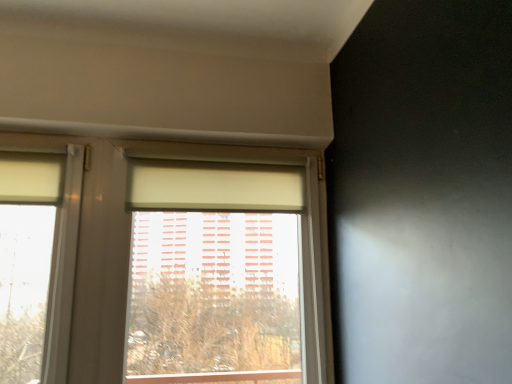
The width and height of the screenshot is (512, 384). Describe the element at coordinates (213, 186) in the screenshot. I see `beige fabric curtain at center` at that location.

The height and width of the screenshot is (384, 512). Identify the location of beige fabric curtain at center. (213, 186).

The height and width of the screenshot is (384, 512). What do you see at coordinates (164, 209) in the screenshot? I see `matte white window at center` at bounding box center [164, 209].

Where is `matte white window at center`? The width and height of the screenshot is (512, 384). matte white window at center is located at coordinates (164, 209).

Based on the photo, in order to face matte white window at center, should I rotate leftwards or rightwards?

To face it directly, rotate left by 4.725 degrees.

This screenshot has width=512, height=384. Identify the location of beige fabric curtain at center. (213, 186).

Which object is positioned more to the left, matte white window at center or beige fabric curtain at center?

beige fabric curtain at center.

Relative to beige fabric curtain at center, is matte white window at center in front or behind?

Clearly, matte white window at center is in front of beige fabric curtain at center.

Is point (287, 200) positioned before point (209, 163)?

That is False.

From the image's perspective, is matte white window at center under beige fabric curtain at center?

Correct, matte white window at center appears lower than beige fabric curtain at center in the image.

From a real-world perspective, is matte white window at center on top of beige fabric curtain at center?

No, from a real-world perspective, matte white window at center is not over beige fabric curtain at center

Can you confirm if matte white window at center is wider than beige fabric curtain at center?

Yes.

Which of these two, matte white window at center or beige fabric curtain at center, stands taller?

Standing taller between the two is matte white window at center.

Looking at the image, does matte white window at center seem bigger or smaller compared to beige fabric curtain at center?

In the image, matte white window at center appears to be larger than beige fabric curtain at center.

Could beige fabric curtain at center be considered to be inside matte white window at center?

Yes.

Is matte white window at center beside beige fabric curtain at center?

matte white window at center and beige fabric curtain at center are clearly separated.

Could you tell me if matte white window at center is turned towards beige fabric curtain at center?

Yes, matte white window at center faces towards beige fabric curtain at center.

How many degrees apart are the facing directions of matte white window at center and beige fabric curtain at center?

0.494 degrees separate the facing orientations of matte white window at center and beige fabric curtain at center.

Locate an element on the screen. The height and width of the screenshot is (384, 512). curtain located above the matte white window at center (from the image's perspective) is located at coordinates (213, 186).

Between beige fabric curtain at center and matte white window at center, which one appears on the left side from the viewer's perspective?

Positioned to the left is beige fabric curtain at center.

Is the position of beige fabric curtain at center more distant than that of matte white window at center?

Yes.

Considering the positions of point (280, 206) and point (133, 166), is point (280, 206) closer or farther from the camera than point (133, 166)?

Point (280, 206) is farther from the camera than point (133, 166).

From the image's perspective, would you say beige fabric curtain at center is shown under matte white window at center?

No.

From the picture: From a real-world perspective, is beige fabric curtain at center on top of matte white window at center?

Indeed, from a real-world perspective, beige fabric curtain at center stands above matte white window at center.

Considering the sizes of beige fabric curtain at center and matte white window at center in the image, is beige fabric curtain at center wider or thinner than matte white window at center?

Clearly, beige fabric curtain at center has less width compared to matte white window at center.

Considering the relative sizes of beige fabric curtain at center and matte white window at center in the image provided, is beige fabric curtain at center taller than matte white window at center?

In fact, beige fabric curtain at center may be shorter than matte white window at center.

Which of these two, beige fabric curtain at center or matte white window at center, is smaller?

beige fabric curtain at center.

Can matte white window at center be found inside beige fabric curtain at center?

Actually, matte white window at center is outside beige fabric curtain at center.

In the scene shown: Is beige fabric curtain at center far from matte white window at center?

beige fabric curtain at center is actually quite close to matte white window at center.

Based on the photo, is beige fabric curtain at center aimed at matte white window at center?

Yes, beige fabric curtain at center is turned towards matte white window at center.

In order to click on window below the beige fabric curtain at center (from the image's perspective) in this screenshot , I will do pos(164,209).

Identify the location of curtain behind the matte white window at center. Image resolution: width=512 pixels, height=384 pixels. (213, 186).

At what (x,y) coordinates should I click in order to perform the action: click on window in front of the beige fabric curtain at center. Please return your answer as a coordinate pair (x, y). The height and width of the screenshot is (384, 512). Looking at the image, I should click on point(164,209).